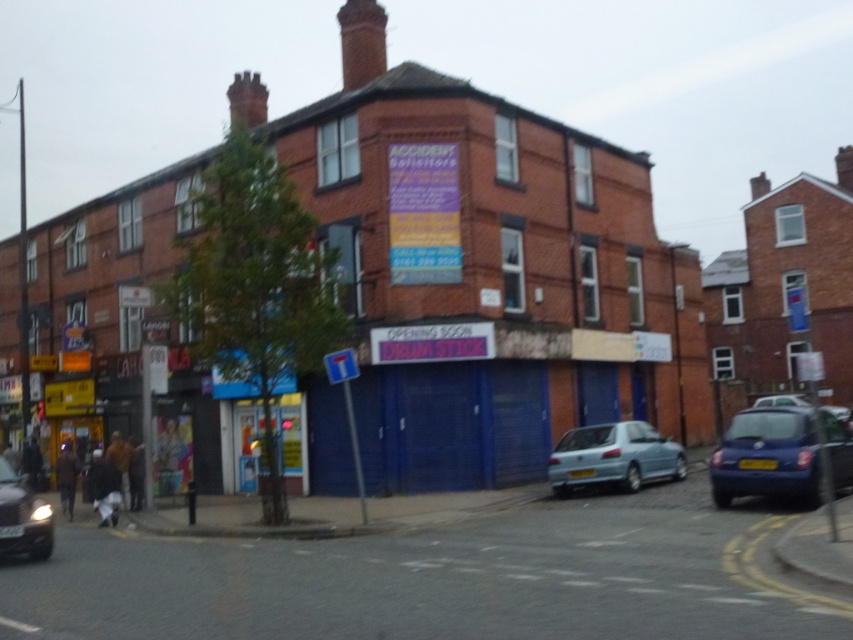
Question: Can you confirm if light blue metallic car at lower center is bigger than shiny silver car at lower left?

Choices:
 (A) yes
 (B) no

Answer: (A)

Question: Which of the following is the closest to the observer?

Choices:
 (A) metallic blue car at right
 (B) light blue metallic car at lower center

Answer: (A)

Question: Which point is closer to the camera?

Choices:
 (A) (722, 449)
 (B) (10, 548)
 (C) (579, 445)

Answer: (B)

Question: Is metallic blue car at right to the right of light blue metallic car at lower center from the viewer's perspective?

Choices:
 (A) no
 (B) yes

Answer: (B)

Question: Can you confirm if metallic blue car at right is positioned to the right of light blue metallic car at lower center?

Choices:
 (A) yes
 (B) no

Answer: (A)

Question: Which point appears farthest from the camera in this image?

Choices:
 (A) (28, 531)
 (B) (576, 472)
 (C) (808, 467)

Answer: (B)